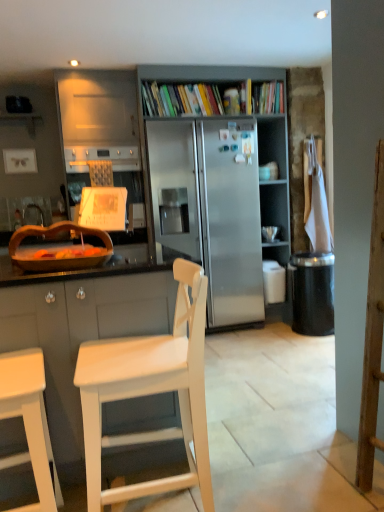
The height and width of the screenshot is (512, 384). I want to click on matte blue coffee cup at upper right, so click(x=264, y=173).

Locate an element on the screen. The width and height of the screenshot is (384, 512). brushed metal faucet at left is located at coordinates (33, 215).

What are the coordinates of `black plastic trash can at lower right` in the screenshot? It's located at (312, 293).

What do you see at coordinates (30, 422) in the screenshot? I see `white matte chair at lower left, arranged as the 2th chair when viewed from the right` at bounding box center [30, 422].

Find the location of a particular element. Image resolution: width=384 pixels, height=512 pixels. white wood chair at center, arranged as the first chair when viewed from the right is located at coordinates (151, 392).

Locate an element on the screen. wooden bowl at left is located at coordinates (59, 249).

Between white wood chair at center, the 2th chair positioned from the left, and wooden bowl at left, which one appears on the left side from the viewer's perspective?

Positioned to the left is wooden bowl at left.

In the scene shown: From a real-world perspective, is white wood chair at center, arranged as the first chair when viewed from the right, on top of wooden bowl at left?

Incorrect, from a real-world perspective, white wood chair at center, arranged as the first chair when viewed from the right, is lower than wooden bowl at left.

Consider the image. Is white wood chair at center, the 2th chair positioned from the left, beside wooden bowl at left?

No, white wood chair at center, the 2th chair positioned from the left, is not with wooden bowl at left.

Is black plastic trash can at lower right bigger or smaller than white wood chair at center, arranged as the first chair when viewed from the right?

Clearly, black plastic trash can at lower right is smaller in size than white wood chair at center, arranged as the first chair when viewed from the right.

From the image's perspective, which is above, black plastic trash can at lower right or white wood chair at center, the 2th chair positioned from the left?

black plastic trash can at lower right appears higher in the image.

The image size is (384, 512). I want to click on trash bin/can on the right of white wood chair at center, arranged as the first chair when viewed from the right, so click(312, 293).

From their relative heights in the image, would you say black plastic trash can at lower right is taller or shorter than white wood chair at center, the 2th chair positioned from the left?

black plastic trash can at lower right is shorter than white wood chair at center, the 2th chair positioned from the left.

Find the location of a particular element. The height and width of the screenshot is (512, 384). sink to the right of brushed metal faucet at left is located at coordinates (59, 249).

Looking at this image, how many degrees apart are the facing directions of wooden bowl at left and brushed metal faucet at left?

The facing directions of wooden bowl at left and brushed metal faucet at left are 37.3 degrees apart.

Considering the sizes of objects wooden bowl at left and brushed metal faucet at left in the image provided, who is shorter, wooden bowl at left or brushed metal faucet at left?

With less height is wooden bowl at left.

Based on their sizes in the image, would you say wooden bowl at left is bigger or smaller than brushed metal faucet at left?

Clearly, wooden bowl at left is larger in size than brushed metal faucet at left.

Considering the positions of points (250, 282) and (321, 323), is point (250, 282) farther from camera compared to point (321, 323)?

Yes, it is behind point (321, 323).

Can you confirm if stainless steel refrigerator at center is taller than black plastic trash can at lower right?

Yes, stainless steel refrigerator at center is taller than black plastic trash can at lower right.

Is stainless steel refrigerator at center outside of black plastic trash can at lower right?

Yes, stainless steel refrigerator at center is located beyond the bounds of black plastic trash can at lower right.

Does matte blue coffee cup at upper right have a larger size compared to stainless steel refrigerator at center?

Actually, matte blue coffee cup at upper right might be smaller than stainless steel refrigerator at center.

Are matte blue coffee cup at upper right and stainless steel refrigerator at center making contact?

No, matte blue coffee cup at upper right is not making contact with stainless steel refrigerator at center.

I want to click on refrigerator below the matte blue coffee cup at upper right (from a real-world perspective), so click(214, 208).

Is the position of matte blue coffee cup at upper right less distant than that of stainless steel refrigerator at center?

No, matte blue coffee cup at upper right is further to the viewer.

Considering the sizes of objects brushed metal faucet at left and white cloth at right in the image provided, who is taller, brushed metal faucet at left or white cloth at right?

With more height is white cloth at right.

Is brushed metal faucet at left spatially inside white cloth at right, or outside of it?

brushed metal faucet at left cannot be found inside white cloth at right.

Considering the positions of point (37, 223) and point (319, 196), is point (37, 223) closer or farther from the camera than point (319, 196)?

Clearly, point (37, 223) is more distant from the camera than point (319, 196).

Which object is thinner, brushed metal faucet at left or white cloth at right?

white cloth at right is thinner.

Does white cloth at right appear on the right side of matte blue coffee cup at upper right?

Indeed, white cloth at right is positioned on the right side of matte blue coffee cup at upper right.

Which is nearer, (318, 207) or (259, 174)?

Point (318, 207).

Is white cloth at right taller or shorter than matte blue coffee cup at upper right?

Considering their sizes, white cloth at right has more height than matte blue coffee cup at upper right.

Locate an element on the screen. This screenshot has width=384, height=512. sink lying on the left of white wood chair at center, arranged as the first chair when viewed from the right is located at coordinates (59, 249).

The width and height of the screenshot is (384, 512). In order to click on trash bin/can behind the white wood chair at center, the 2th chair positioned from the left in this screenshot , I will do `click(312, 293)`.

From the image, which object appears to be farther from wooden bowl at left, white matte chair at lower left, positioned as the first chair in left-to-right order, or white cloth at right?

white cloth at right.

From the image, which object appears to be farther from white cloth at right, black plastic trash can at lower right or wooden bowl at left?

wooden bowl at left is further to white cloth at right.

Estimate the real-world distances between objects in this image. Which object is closer to black plastic trash can at lower right, wooden bowl at left or matte blue coffee cup at upper right?

matte blue coffee cup at upper right is closer to black plastic trash can at lower right.

Which object lies nearer to the anchor point matte blue coffee cup at upper right, wooden bowl at left or stainless steel refrigerator at center?

Among the two, stainless steel refrigerator at center is located nearer to matte blue coffee cup at upper right.

Based on their spatial positions, is stainless steel refrigerator at center or white wood chair at center, the 2th chair positioned from the left, further from wooden bowl at left?

Among the two, stainless steel refrigerator at center is located further to wooden bowl at left.

Considering their positions, is wooden bowl at left positioned further to matte blue coffee cup at upper right than black plastic trash can at lower right?

Among the two, wooden bowl at left is located further to matte blue coffee cup at upper right.

Which object lies further to the anchor point matte blue coffee cup at upper right, brushed metal faucet at left or stainless steel refrigerator at center?

brushed metal faucet at left.

Looking at the image, which one is located further to matte blue coffee cup at upper right, black plastic trash can at lower right or wooden bowl at left?

wooden bowl at left is positioned further to the anchor matte blue coffee cup at upper right.

I want to click on refrigerator positioned between wooden bowl at left and matte blue coffee cup at upper right from near to far, so click(x=214, y=208).

Locate an element on the screen. The height and width of the screenshot is (512, 384). sink located between white matte chair at lower left, arranged as the 2th chair when viewed from the right, and white cloth at right in the depth direction is located at coordinates (59, 249).

Identify the location of refrigerator between white matte chair at lower left, positioned as the first chair in left-to-right order, and white cloth at right in the front-back direction. (214, 208).

Identify the location of chair between white matte chair at lower left, arranged as the 2th chair when viewed from the right, and brushed metal faucet at left from front to back. (151, 392).